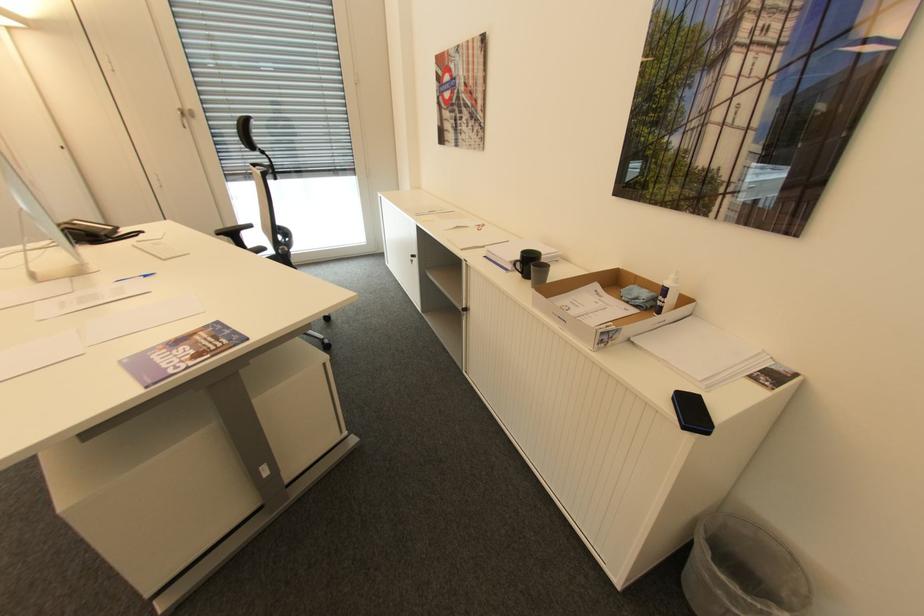
The image size is (924, 616). Describe the element at coordinates (667, 294) in the screenshot. I see `the white spray bottle` at that location.